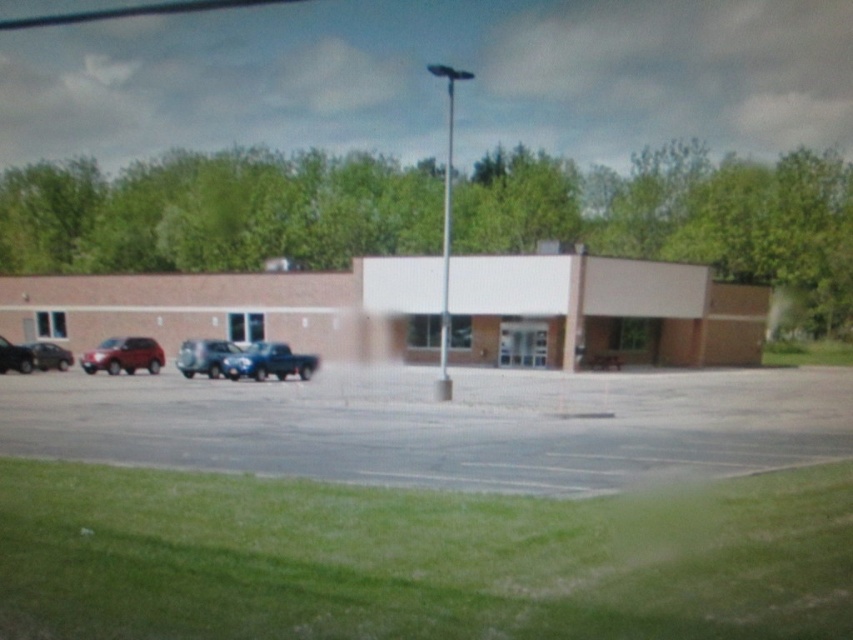
Question: Which point appears farthest from the camera in this image?

Choices:
 (A) (198, 358)
 (B) (67, 358)
 (C) (302, 372)

Answer: (B)

Question: Where is metallic blue truck at center located in relation to satin silver truck at center in the image?

Choices:
 (A) below
 (B) above

Answer: (A)

Question: Which object appears farthest from the camera in this image?

Choices:
 (A) matte red suv at lower left
 (B) matte black car at left
 (C) shiny silver sedan at left
 (D) metallic blue truck at center

Answer: (C)

Question: Which object is positioned farthest from the matte black car at left?

Choices:
 (A) shiny silver sedan at left
 (B) satin silver truck at center
 (C) gray asphalt parking lot at center
 (D) metallic blue truck at center

Answer: (C)

Question: From the image, what is the correct spatial relationship of gray asphalt parking lot at center in relation to matte red suv at lower left?

Choices:
 (A) below
 (B) above

Answer: (A)

Question: Is gray asphalt parking lot at center to the right of matte black car at left from the viewer's perspective?

Choices:
 (A) yes
 (B) no

Answer: (A)